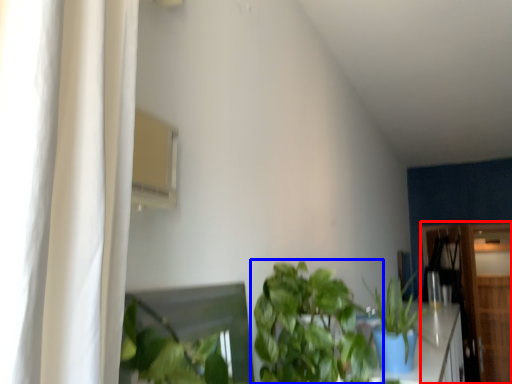
Question: Among these objects, which one is farthest to the camera, dresser (highlighted by a red box) or houseplant (highlighted by a blue box)?

Choices:
 (A) dresser
 (B) houseplant

Answer: (A)